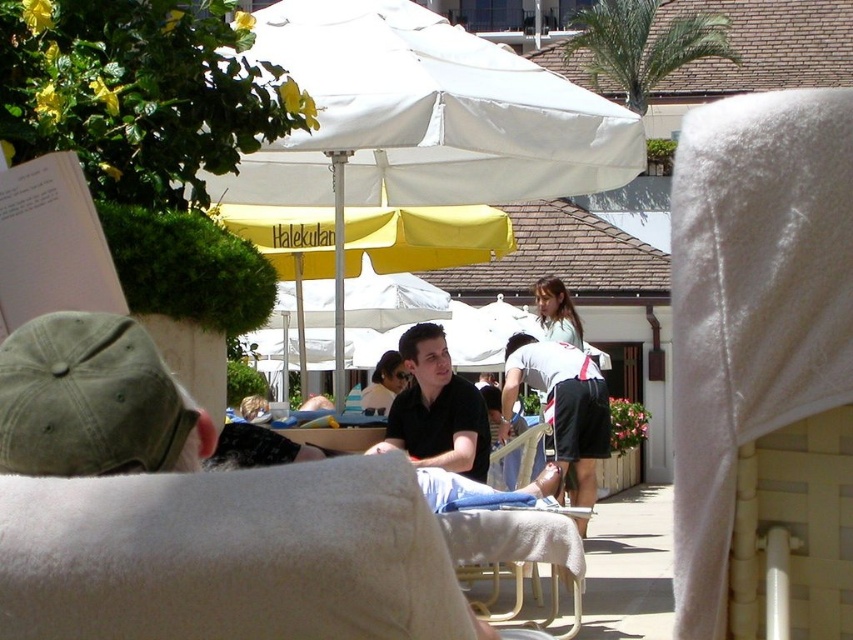
Question: Does black matte shirt at center have a smaller size compared to white cotton shorts at center?

Choices:
 (A) no
 (B) yes

Answer: (B)

Question: Considering the real-world distances, which object is closest to the black matte shirt at center?

Choices:
 (A) white fabric umbrella at center
 (B) light brown hair at center
 (C) white cotton shorts at center

Answer: (A)

Question: Which object is closer to the camera taking this photo?

Choices:
 (A) white fabric umbrella at center
 (B) light brown hair at center

Answer: (A)

Question: Is black matte shirt at center above white cotton shorts at center?

Choices:
 (A) yes
 (B) no

Answer: (A)

Question: Is white cotton shorts at center above light brown hair at center?

Choices:
 (A) yes
 (B) no

Answer: (B)

Question: Among these objects, which one is nearest to the camera?

Choices:
 (A) white cotton shorts at center
 (B) black matte shirt at center
 (C) white fabric umbrella at center
 (D) light brown hair at center

Answer: (C)